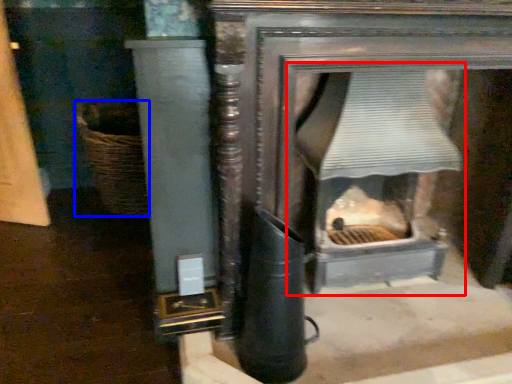
Question: Which object appears farthest to the camera in this image, fireplace (highlighted by a red box) or basket (highlighted by a blue box)?

Choices:
 (A) fireplace
 (B) basket

Answer: (B)